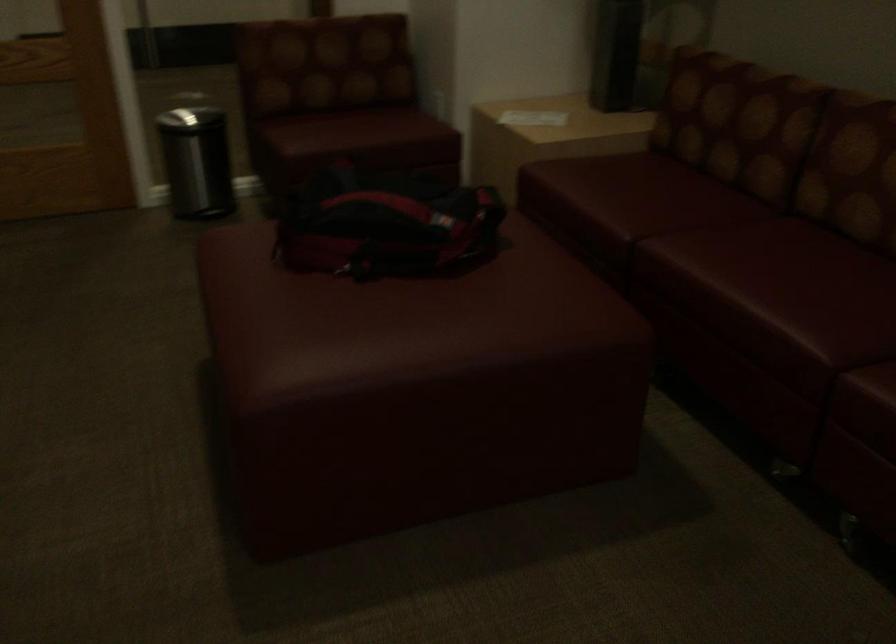
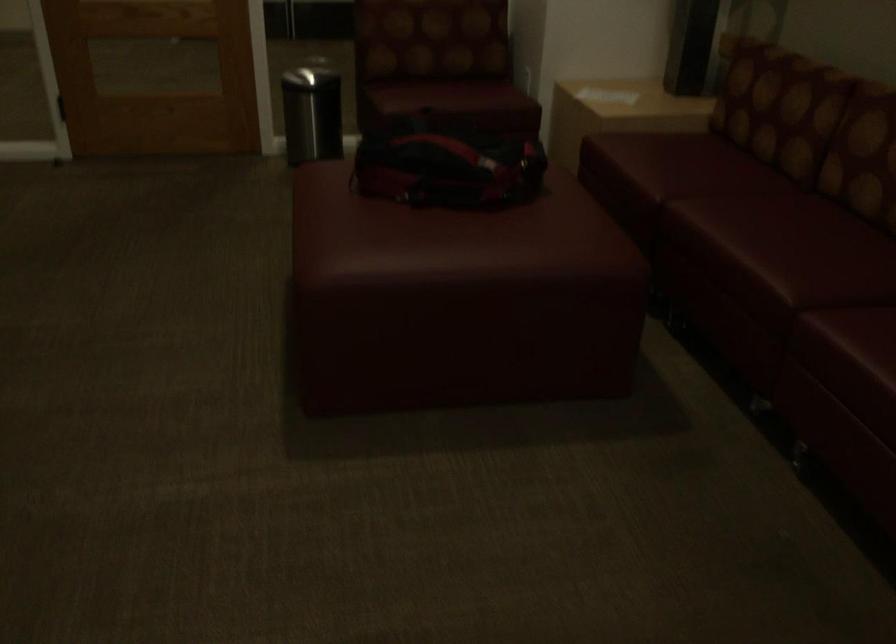
The point at (x=736, y=285) is marked in the first image. Where is the corresponding point in the second image?

(736, 240)